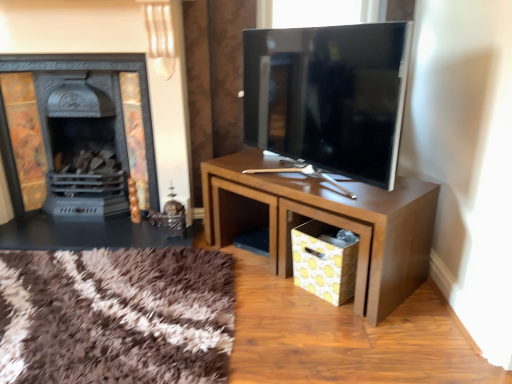
I want to click on free point in front of yellow paper drawer at lower right, so click(329, 323).